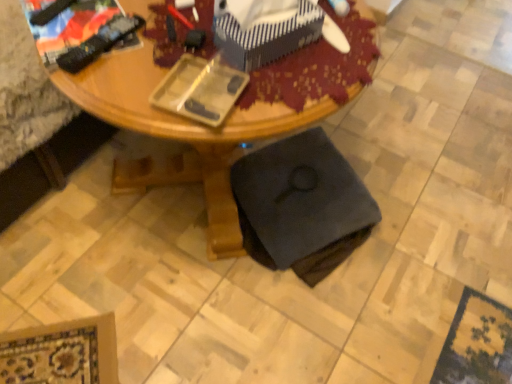
Question: Should I look upward or downward to see wooden desk at center?

Choices:
 (A) up
 (B) down

Answer: (A)

Question: Does wooden desk at center appear on the right side of black fabric swivel chair at lower center?

Choices:
 (A) no
 (B) yes

Answer: (A)

Question: Is the position of wooden desk at center less distant than that of black fabric swivel chair at lower center?

Choices:
 (A) yes
 (B) no

Answer: (A)

Question: Considering the relative positions of wooden desk at center and black fabric swivel chair at lower center in the image provided, is wooden desk at center to the left of black fabric swivel chair at lower center from the viewer's perspective?

Choices:
 (A) no
 (B) yes

Answer: (B)

Question: From the image's perspective, is wooden desk at center on black fabric swivel chair at lower center?

Choices:
 (A) yes
 (B) no

Answer: (A)

Question: Does wooden desk at center have a lesser height compared to black fabric swivel chair at lower center?

Choices:
 (A) yes
 (B) no

Answer: (B)

Question: From a real-world perspective, is wooden desk at center located higher than black fabric swivel chair at lower center?

Choices:
 (A) yes
 (B) no

Answer: (A)

Question: Can you confirm if blue striped fabric box at upper center is taller than black fabric swivel chair at lower center?

Choices:
 (A) no
 (B) yes

Answer: (A)

Question: Would you say blue striped fabric box at upper center is outside black fabric swivel chair at lower center?

Choices:
 (A) yes
 (B) no

Answer: (A)

Question: Could you tell me if blue striped fabric box at upper center is turned towards black fabric swivel chair at lower center?

Choices:
 (A) yes
 (B) no

Answer: (B)

Question: Is black fabric swivel chair at lower center located within blue striped fabric box at upper center?

Choices:
 (A) yes
 (B) no

Answer: (B)

Question: From the image's perspective, is blue striped fabric box at upper center below black fabric swivel chair at lower center?

Choices:
 (A) no
 (B) yes

Answer: (A)

Question: From the image's perspective, is blue striped fabric box at upper center above black fabric swivel chair at lower center?

Choices:
 (A) no
 (B) yes

Answer: (B)

Question: Does black fabric swivel chair at lower center turn towards wooden desk at center?

Choices:
 (A) no
 (B) yes

Answer: (B)